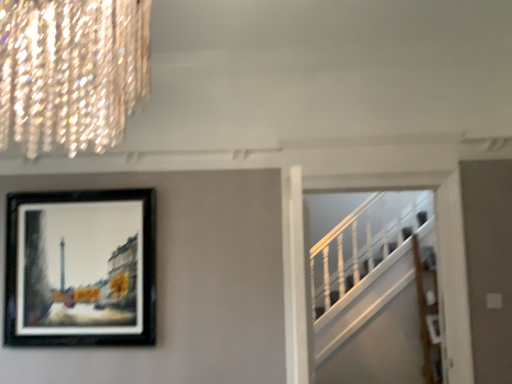
Question: Does black matte picture frame at upper left have a lesser width compared to white wooden stairs at right?

Choices:
 (A) yes
 (B) no

Answer: (A)

Question: Is black matte picture frame at upper left smaller than white wooden stairs at right?

Choices:
 (A) no
 (B) yes

Answer: (B)

Question: Is black matte picture frame at upper left taller than white wooden stairs at right?

Choices:
 (A) no
 (B) yes

Answer: (A)

Question: Is white wooden stairs at right located within black matte picture frame at upper left?

Choices:
 (A) yes
 (B) no

Answer: (B)

Question: Considering the relative sizes of black matte picture frame at upper left and white wooden stairs at right in the image provided, is black matte picture frame at upper left bigger than white wooden stairs at right?

Choices:
 (A) no
 (B) yes

Answer: (A)

Question: Is black matte picture frame at upper left far from white wooden stairs at right?

Choices:
 (A) no
 (B) yes

Answer: (B)

Question: From the image's perspective, would you say white wooden stairs at right is shown under black matte picture frame at upper left?

Choices:
 (A) no
 (B) yes

Answer: (B)

Question: Is white wooden stairs at right closer to camera compared to black matte picture frame at upper left?

Choices:
 (A) no
 (B) yes

Answer: (B)

Question: Does white wooden stairs at right have a larger size compared to black matte picture frame at upper left?

Choices:
 (A) no
 (B) yes

Answer: (B)

Question: Is white wooden stairs at right shorter than black matte picture frame at upper left?

Choices:
 (A) yes
 (B) no

Answer: (B)

Question: From the image's perspective, is white wooden stairs at right above black matte picture frame at upper left?

Choices:
 (A) yes
 (B) no

Answer: (B)

Question: Is the position of white wooden stairs at right more distant than that of black matte picture frame at upper left?

Choices:
 (A) no
 (B) yes

Answer: (A)

Question: Is black matte picture frame at upper left not near crystal glass chandelier at upper left?

Choices:
 (A) no
 (B) yes

Answer: (B)